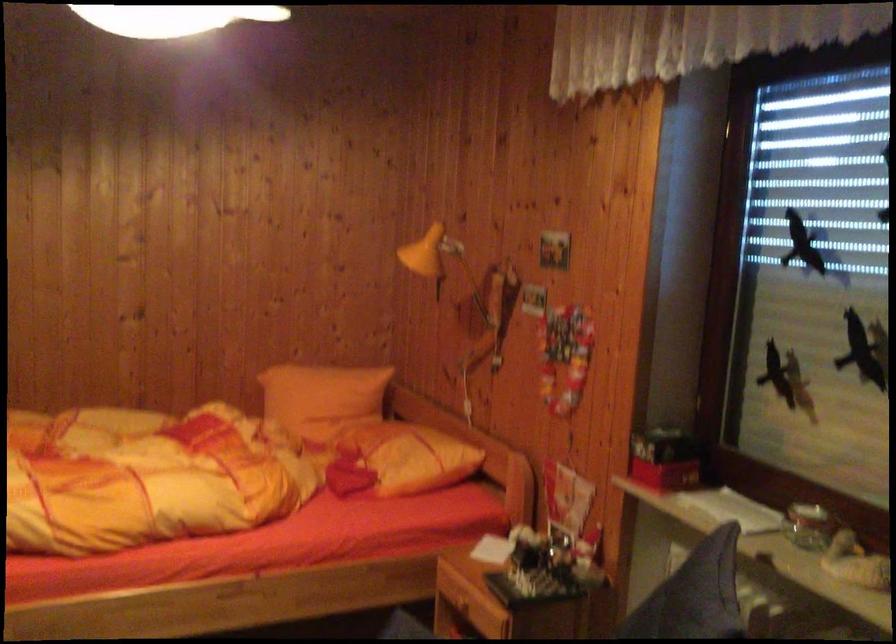
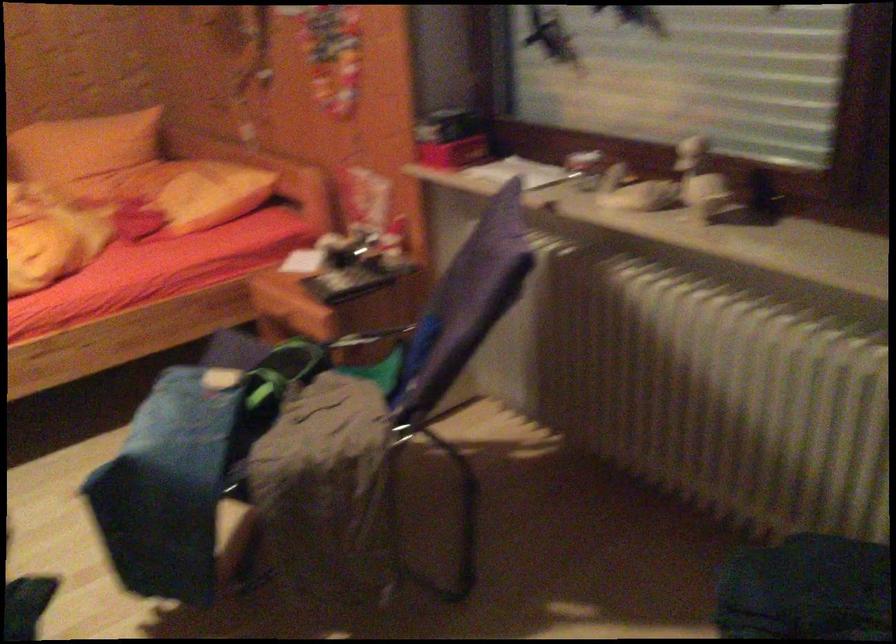
Question: The images are taken continuously from a first-person perspective. In which direction are you moving?

Choices:
 (A) Left
 (B) Right
 (C) Forward
 (D) Backward

Answer: (D)